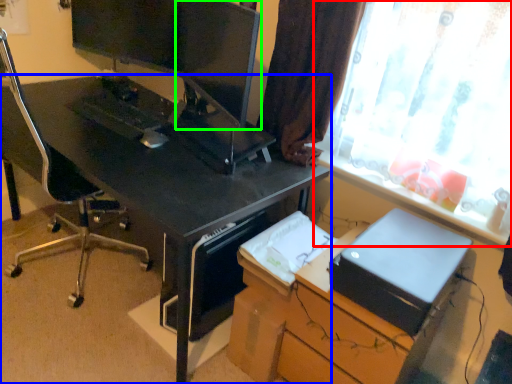
Question: Which object is the farthest from window (highlighted by a red box)? Choose among these: desk (highlighted by a blue box) or computer monitor (highlighted by a green box).

Choices:
 (A) desk
 (B) computer monitor

Answer: (B)